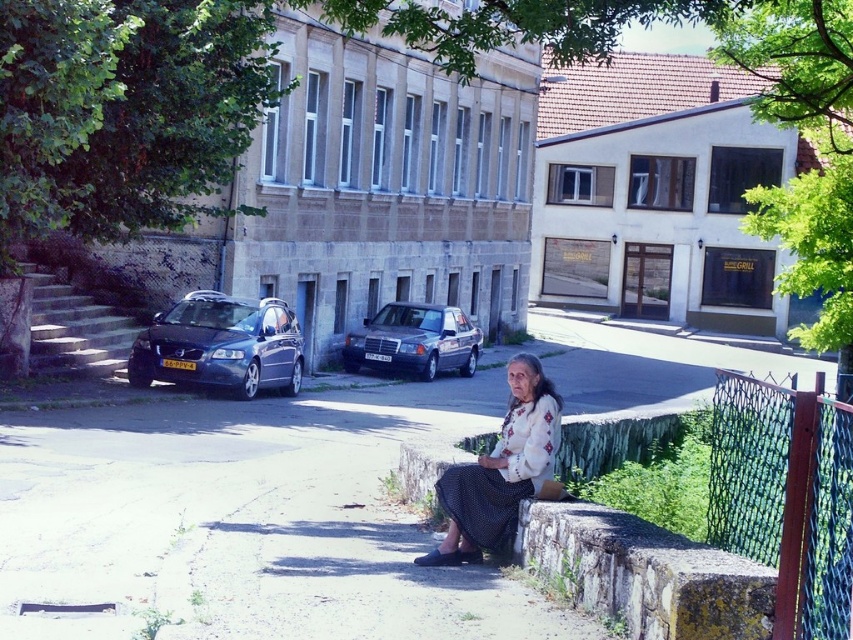
Question: Can you confirm if green mesh fence at right is bigger than shiny metallic car at left?

Choices:
 (A) no
 (B) yes

Answer: (A)

Question: Which object is the closest to the white embroidered blouse at center?

Choices:
 (A) shiny metallic car at left
 (B) stone at lower right
 (C) metallic silver sedan at center
 (D) green mesh fence at right

Answer: (B)

Question: Which point is farther to the camera?

Choices:
 (A) white embroidered blouse at center
 (B) shiny metallic car at left
 (C) stone at lower right

Answer: (B)

Question: Which point is closer to the camera?

Choices:
 (A) white embroidered blouse at center
 (B) green mesh fence at right
 (C) metallic silver sedan at center

Answer: (B)

Question: Does green mesh fence at right come in front of white embroidered blouse at center?

Choices:
 (A) yes
 (B) no

Answer: (A)

Question: Is shiny metallic car at left in front of white embroidered blouse at center?

Choices:
 (A) yes
 (B) no

Answer: (B)